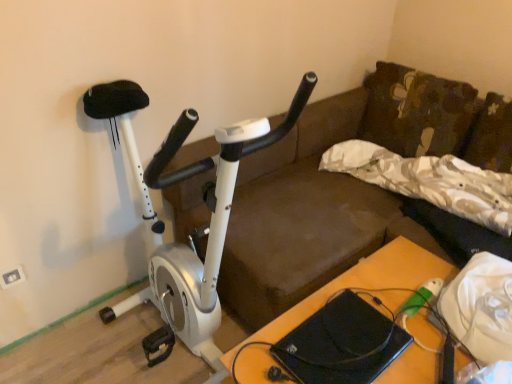
Where is `wooden table at lower right`? This screenshot has width=512, height=384. wooden table at lower right is located at coordinates (361, 285).

The width and height of the screenshot is (512, 384). In order to click on white plastic electric outlet at upper left in this screenshot , I will do `click(12, 277)`.

You are a GUI agent. You are given a task and a screenshot of the screen. Output one action in this format:
    pyautogui.click(x=<x>, y=<y>)
    Task: Click on the camouflage fabric pillow at center
    This screenshot has width=512, height=384.
    Given the screenshot: What is the action you would take?
    pyautogui.click(x=429, y=181)

Image resolution: width=512 pixels, height=384 pixels. I want to click on wooden table at lower right, so click(361, 285).

Consider the image. Can you see wooden table at lower right touching camouflage fabric pillow at center?

No, wooden table at lower right is not with camouflage fabric pillow at center.

At what (x,y) coordinates should I click in order to perform the action: click on table that is under the camouflage fabric pillow at center (from a real-world perspective). Please return your answer as a coordinate pair (x, y). Looking at the image, I should click on (361, 285).

Is camouflage fabric pillow at center at the back of wooden table at lower right?

No, wooden table at lower right's orientation is not away from camouflage fabric pillow at center.

From a real-world perspective, is wooden table at lower right positioned above or below camouflage fabric pillow at center?

Clearly, from a real-world perspective, wooden table at lower right is below camouflage fabric pillow at center.

How many degrees apart are the facing directions of wooden table at lower right and white metallic stationary bicycle at left?

The angle between the facing direction of wooden table at lower right and the facing direction of white metallic stationary bicycle at left is 90.8 degrees.

Is wooden table at lower right at the left side of white metallic stationary bicycle at left?

In fact, wooden table at lower right is to the right of white metallic stationary bicycle at left.

Is wooden table at lower right oriented away from white metallic stationary bicycle at left?

wooden table at lower right is not turned away from white metallic stationary bicycle at left.

From a real-world perspective, is wooden table at lower right below white metallic stationary bicycle at left?

Yes, from a real-world perspective, wooden table at lower right is below white metallic stationary bicycle at left.

What's the angular difference between white plastic electric outlet at upper left and wooden table at lower right's facing directions?

90.9 degrees.

Is white plastic electric outlet at upper left far away from wooden table at lower right?

Indeed, white plastic electric outlet at upper left is not near wooden table at lower right.

From the image's perspective, does white plastic electric outlet at upper left appear lower than wooden table at lower right?

No.

Considering the relative positions of wooden table at lower right and white plastic electric outlet at upper left in the image provided, is wooden table at lower right to the left of white plastic electric outlet at upper left from the viewer's perspective?

No, wooden table at lower right is not to the left of white plastic electric outlet at upper left.

Is wooden table at lower right not close to white plastic electric outlet at upper left?

wooden table at lower right is positioned a significant distance from white plastic electric outlet at upper left.

From the picture: What's the angular difference between wooden table at lower right and white plastic electric outlet at upper left's facing directions?

The angular difference between wooden table at lower right and white plastic electric outlet at upper left is 90.9 degrees.

From a real-world perspective, between wooden table at lower right and white plastic electric outlet at upper left, who is vertically higher?

From a 3D spatial view, white plastic electric outlet at upper left is above.

Is white plastic electric outlet at upper left directly adjacent to camouflage fabric pillow at center?

They are not placed beside each other.

Can you confirm if white plastic electric outlet at upper left is thinner than camouflage fabric pillow at center?

Indeed, white plastic electric outlet at upper left has a lesser width compared to camouflage fabric pillow at center.

Is white plastic electric outlet at upper left to the right of camouflage fabric pillow at center from the viewer's perspective?

In fact, white plastic electric outlet at upper left is to the left of camouflage fabric pillow at center.

From a real-world perspective, is white plastic electric outlet at upper left located beneath camouflage fabric pillow at center?

Correct, in the physical world, white plastic electric outlet at upper left is lower than camouflage fabric pillow at center.

The width and height of the screenshot is (512, 384). Identify the location of pillow behind the white metallic stationary bicycle at left. (429, 181).

Considering the positions of objects camouflage fabric pillow at center and white metallic stationary bicycle at left in the image provided, who is in front, camouflage fabric pillow at center or white metallic stationary bicycle at left?

white metallic stationary bicycle at left is in front.

How many degrees apart are the facing directions of camouflage fabric pillow at center and white metallic stationary bicycle at left?

90.5 degrees separate the facing orientations of camouflage fabric pillow at center and white metallic stationary bicycle at left.

From the image's perspective, does white plastic electric outlet at upper left appear higher than white metallic stationary bicycle at left?

No.

Considering the sizes of white plastic electric outlet at upper left and white metallic stationary bicycle at left in the image, is white plastic electric outlet at upper left wider or thinner than white metallic stationary bicycle at left?

In the image, white plastic electric outlet at upper left appears to be more narrow than white metallic stationary bicycle at left.

Find the location of a particular element. The width and height of the screenshot is (512, 384). stationary bicycle that is in front of the white plastic electric outlet at upper left is located at coordinates (204, 200).

In order to click on pillow above the wooden table at lower right (from the image's perspective) in this screenshot , I will do `click(429, 181)`.

I want to click on stationary bicycle in front of the wooden table at lower right, so click(x=204, y=200).

From the image, which object appears to be farther from wooden table at lower right, white plastic electric outlet at upper left or camouflage fabric pillow at center?

white plastic electric outlet at upper left.

When comparing their distances from white plastic electric outlet at upper left, does white metallic stationary bicycle at left or wooden table at lower right seem further?

wooden table at lower right is positioned further to the anchor white plastic electric outlet at upper left.

From the image, which object appears to be farther from camouflage fabric pillow at center, wooden table at lower right or white plastic electric outlet at upper left?

The object further to camouflage fabric pillow at center is white plastic electric outlet at upper left.

In the scene shown: Which object lies nearer to the anchor point white plastic electric outlet at upper left, wooden table at lower right or white metallic stationary bicycle at left?

white metallic stationary bicycle at left.

From the image, which object appears to be farther from wooden table at lower right, white metallic stationary bicycle at left or camouflage fabric pillow at center?

white metallic stationary bicycle at left is positioned further to the anchor wooden table at lower right.

Which object lies further to the anchor point camouflage fabric pillow at center, white plastic electric outlet at upper left or white metallic stationary bicycle at left?

white plastic electric outlet at upper left is positioned further to the anchor camouflage fabric pillow at center.

Based on their spatial positions, is camouflage fabric pillow at center or white metallic stationary bicycle at left closer to wooden table at lower right?

camouflage fabric pillow at center is closer to wooden table at lower right.

Looking at the image, which one is located further to camouflage fabric pillow at center, white plastic electric outlet at upper left or wooden table at lower right?

white plastic electric outlet at upper left.

Locate an element on the screen. This screenshot has height=384, width=512. table between white metallic stationary bicycle at left and camouflage fabric pillow at center is located at coordinates (361, 285).

The image size is (512, 384). What are the coordinates of `stationary bicycle between white plastic electric outlet at upper left and camouflage fabric pillow at center in the horizontal direction` in the screenshot? It's located at (204, 200).

Where is `table between white plastic electric outlet at upper left and camouflage fabric pillow at center in the horizontal direction`? This screenshot has height=384, width=512. table between white plastic electric outlet at upper left and camouflage fabric pillow at center in the horizontal direction is located at coordinates (361, 285).

Find the location of `stationary bicycle between white plastic electric outlet at upper left and wooden table at lower right in the horizontal direction`. stationary bicycle between white plastic electric outlet at upper left and wooden table at lower right in the horizontal direction is located at coordinates (204, 200).